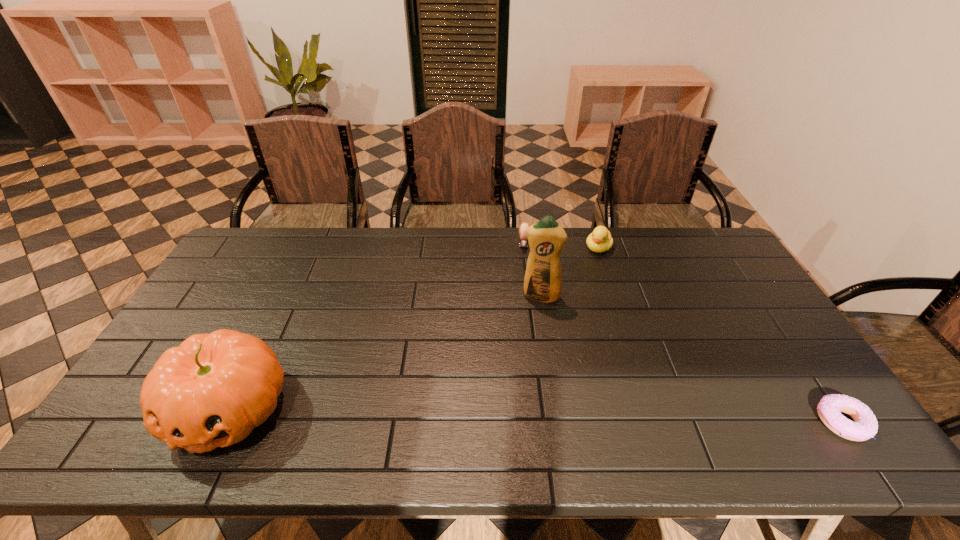
This screenshot has width=960, height=540. I want to click on vacant space positioned 0.230m on the label of the detergent, so click(x=525, y=362).

What are the coordinates of `free spot located 0.240m on the label of the detergent` in the screenshot? It's located at (524, 366).

Where is `free spot located 0.120m on the label of the detergent`? free spot located 0.120m on the label of the detergent is located at coordinates (531, 333).

I want to click on free space located on the beak of the duckling, so click(x=587, y=269).

Locate an element on the screen. vacant space positioned on the beak of the duckling is located at coordinates (586, 271).

At what (x,y) coordinates should I click in order to perform the action: click on blank space located on the beak of the duckling. Please return your answer as a coordinate pair (x, y). Looking at the image, I should click on (568, 297).

Locate an element on the screen. vacant region located 0.270m on the front-facing side of the second shortest object is located at coordinates (522, 308).

Locate an element on the screen. The width and height of the screenshot is (960, 540). vacant region located on the front-facing side of the second shortest object is located at coordinates (522, 322).

Locate an element on the screen. free space located 0.340m on the front-facing side of the second shortest object is located at coordinates (522, 325).

You are a GUI agent. You are given a task and a screenshot of the screen. Output one action in this format:
    pyautogui.click(x=<x>, y=<y>)
    Task: Click on the duckling present at the far edge
    Image resolution: width=960 pixels, height=540 pixels.
    Given the screenshot: What is the action you would take?
    pyautogui.click(x=600, y=240)